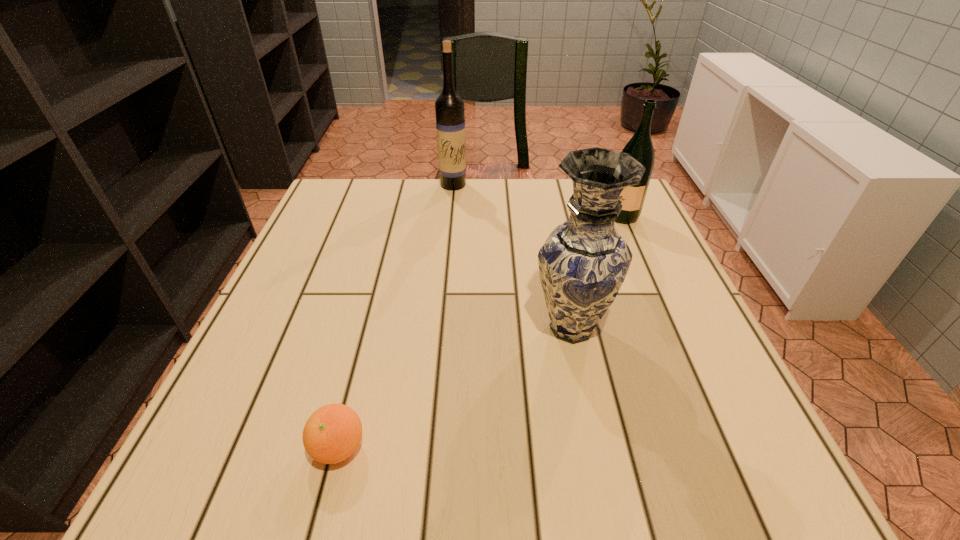
Locate an element on the screen. The height and width of the screenshot is (540, 960). free space at the far left corner is located at coordinates (353, 195).

In order to click on free space at the near left corner of the desktop in this screenshot , I will do `click(251, 494)`.

This screenshot has width=960, height=540. What are the coordinates of `blank region between the vase and the orange` in the screenshot? It's located at pos(455,388).

Where is `vacant space in between the left wine bottle and the second farthest object`? This screenshot has width=960, height=540. vacant space in between the left wine bottle and the second farthest object is located at coordinates (535, 201).

I want to click on empty space between the farthest object and the third nearest object, so click(x=535, y=201).

Identify the location of free space that is in between the leftmost object and the third object from left to right. (455, 388).

Locate an element on the screen. Image resolution: width=960 pixels, height=540 pixels. blank region between the shortest object and the rightmost object is located at coordinates point(477,333).

Image resolution: width=960 pixels, height=540 pixels. I want to click on vacant point located between the left wine bottle and the leftmost object, so click(x=396, y=316).

Locate an element on the screen. This screenshot has height=540, width=960. vacant space that's between the orange and the third tallest object is located at coordinates (477, 333).

Locate an element on the screen. The height and width of the screenshot is (540, 960). vacant space in between the leftmost object and the right wine bottle is located at coordinates (477, 333).